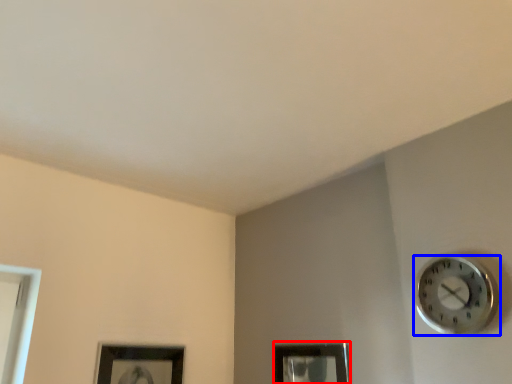
Question: Which of the following is the closest to the observer, picture frame (highlighted by a red box) or wall clock (highlighted by a blue box)?

Choices:
 (A) picture frame
 (B) wall clock

Answer: (B)